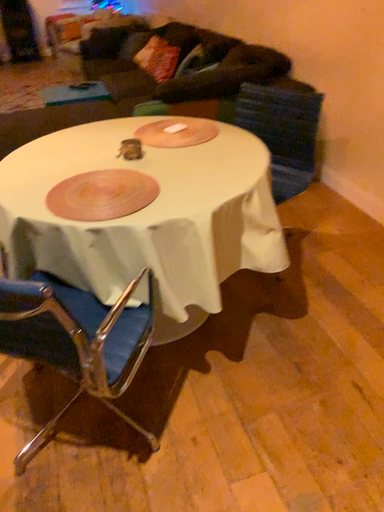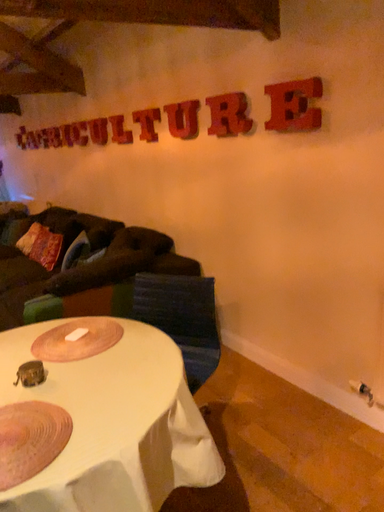
Question: How did the camera likely rotate when shooting the video?

Choices:
 (A) rotated left
 (B) rotated right

Answer: (B)